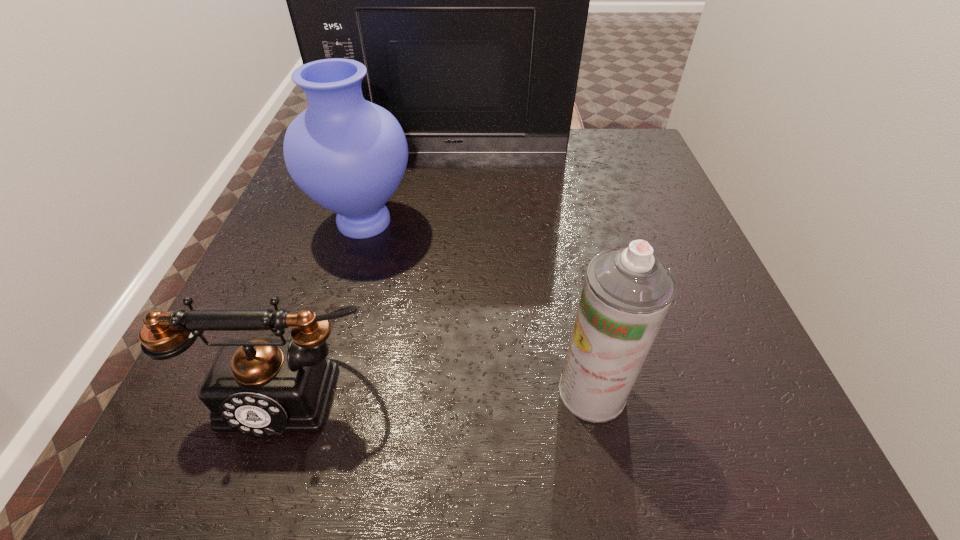
In the image, there is a desktop. What are the coordinates of `free space at the far right corner` in the screenshot? It's located at (650, 168).

Image resolution: width=960 pixels, height=540 pixels. Find the location of `free spot between the aerosol can and the microwave oven`. free spot between the aerosol can and the microwave oven is located at coordinates (519, 272).

You are a GUI agent. You are given a task and a screenshot of the screen. Output one action in this format:
    pyautogui.click(x=<x>, y=<y>)
    Task: Click on the free space between the aerosol can and the second farthest object
    The width and height of the screenshot is (960, 540).
    Given the screenshot: What is the action you would take?
    pyautogui.click(x=478, y=307)

The width and height of the screenshot is (960, 540). Find the location of `vacant space in between the vase and the aerosol can`. vacant space in between the vase and the aerosol can is located at coordinates (478, 307).

Where is `free spot between the aerosol can and the shortest object`? Image resolution: width=960 pixels, height=540 pixels. free spot between the aerosol can and the shortest object is located at coordinates (440, 390).

At what (x,y) coordinates should I click in order to perform the action: click on vacant area that lies between the aerosol can and the third nearest object. Please return your answer as a coordinate pair (x, y). The image size is (960, 540). Looking at the image, I should click on (478, 307).

Identify the location of vacant area that lies between the aerosol can and the microwave oven. The width and height of the screenshot is (960, 540). (519, 272).

At what (x,y) coordinates should I click in order to perform the action: click on vacant space in between the telephone and the vase. Please return your answer as a coordinate pair (x, y). The height and width of the screenshot is (540, 960). Looking at the image, I should click on (326, 305).

This screenshot has width=960, height=540. Find the location of `vacant area between the microwave oven and the vase`. vacant area between the microwave oven and the vase is located at coordinates (406, 187).

The image size is (960, 540). I want to click on empty space between the tallest object and the vase, so click(406, 187).